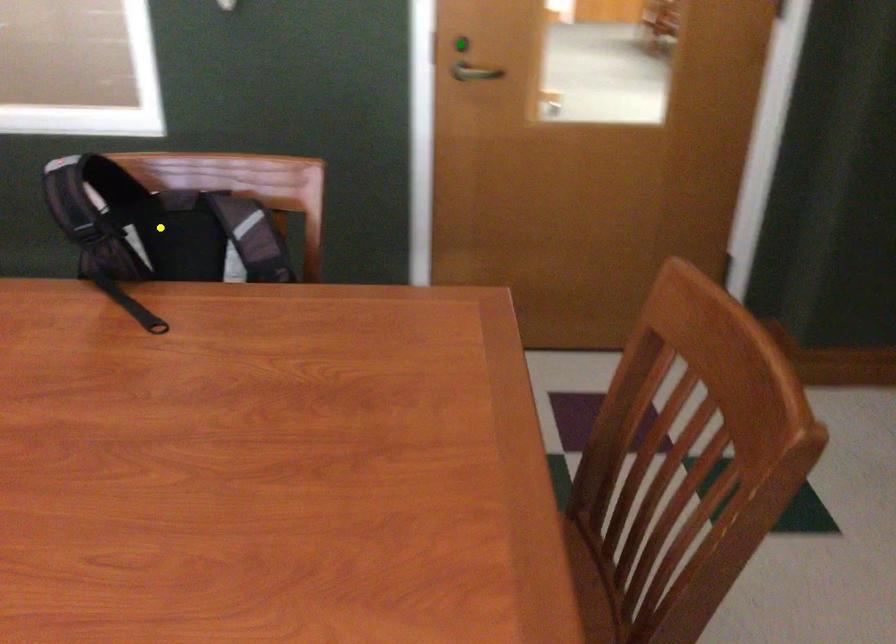
Order these from nearest to farthest:
1. yellow point
2. green point
3. orange point

green point, yellow point, orange point